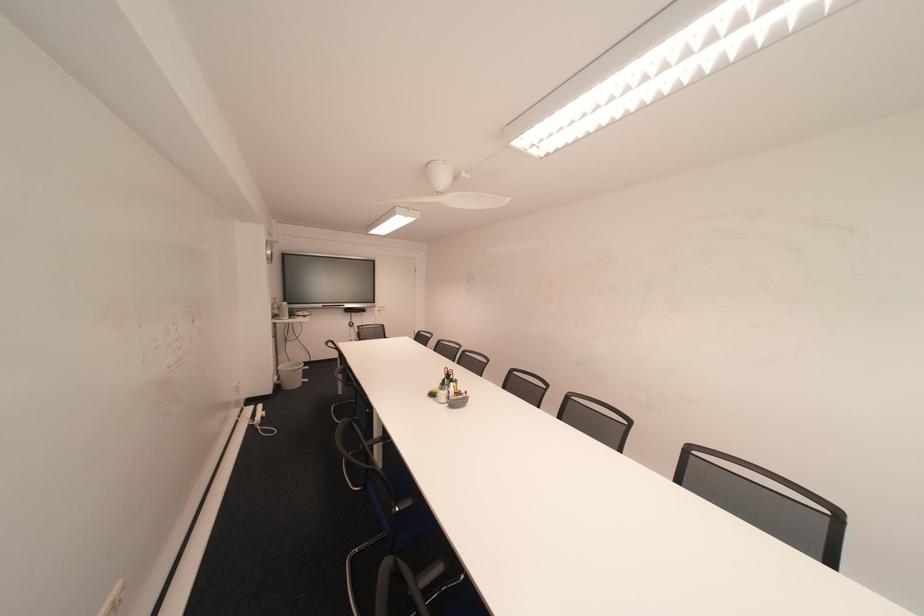
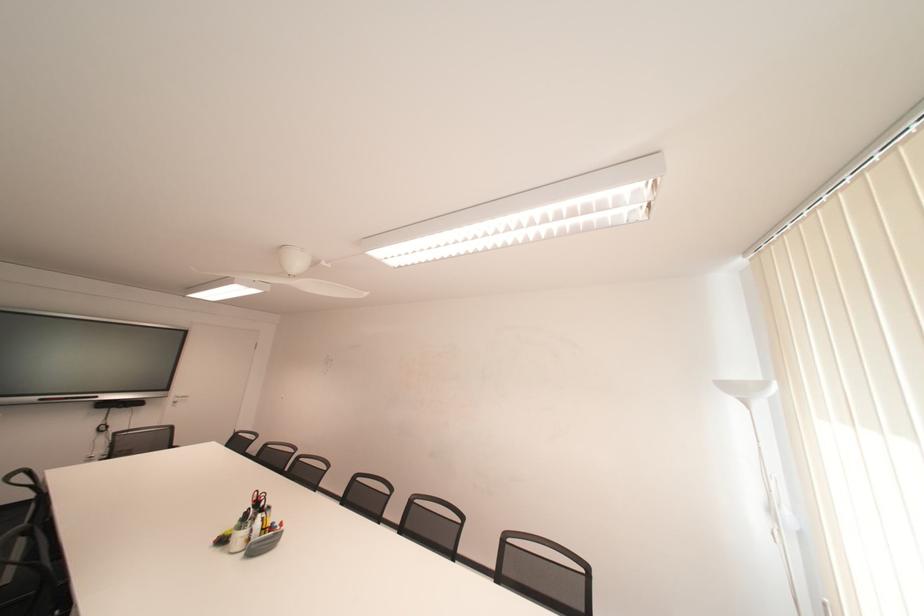
The first image is from the beginning of the video and the second image is from the end. How did the camera likely rotate when shooting the video?

The rotation direction of the camera is right-up.